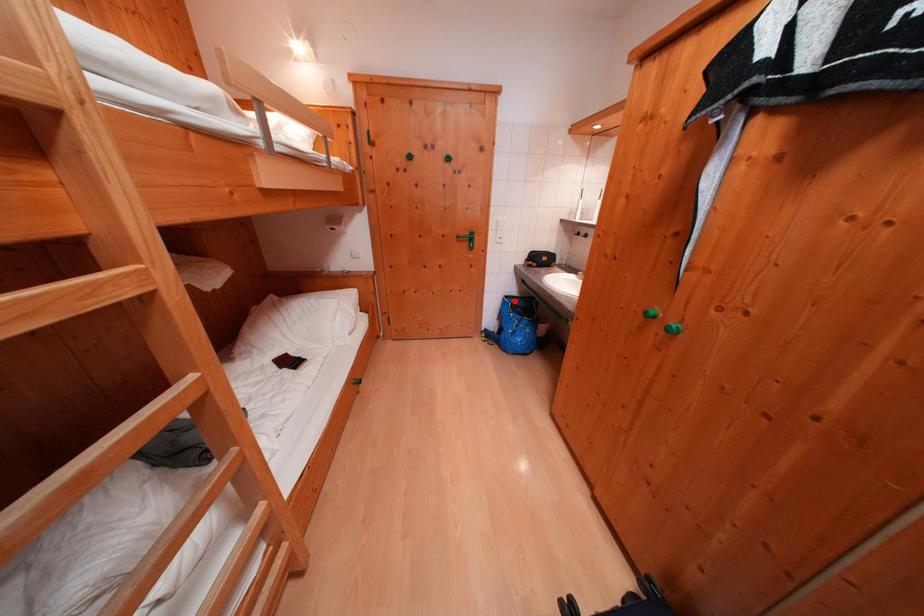
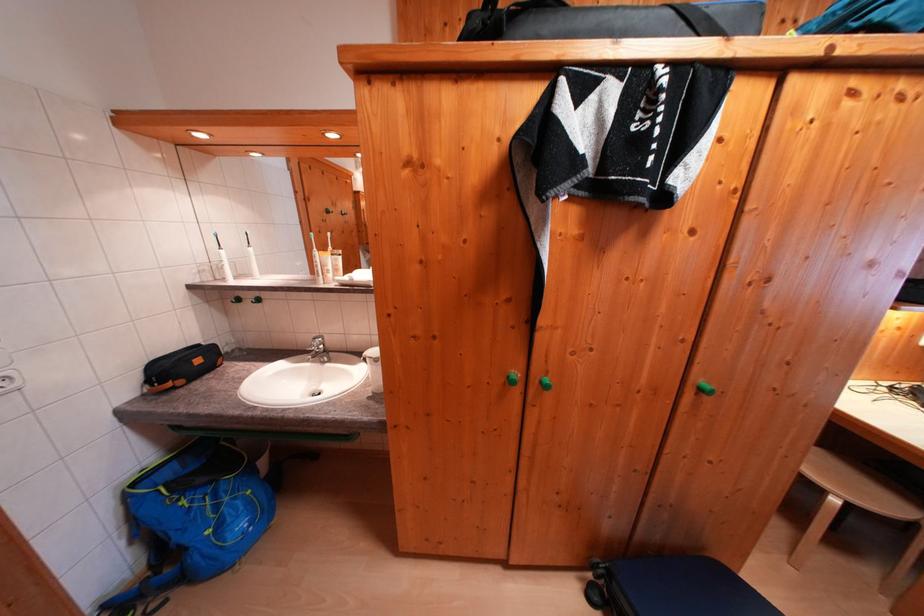
Where in the second image is the point corresponding to the highlighted location from the first image?

(142, 488)